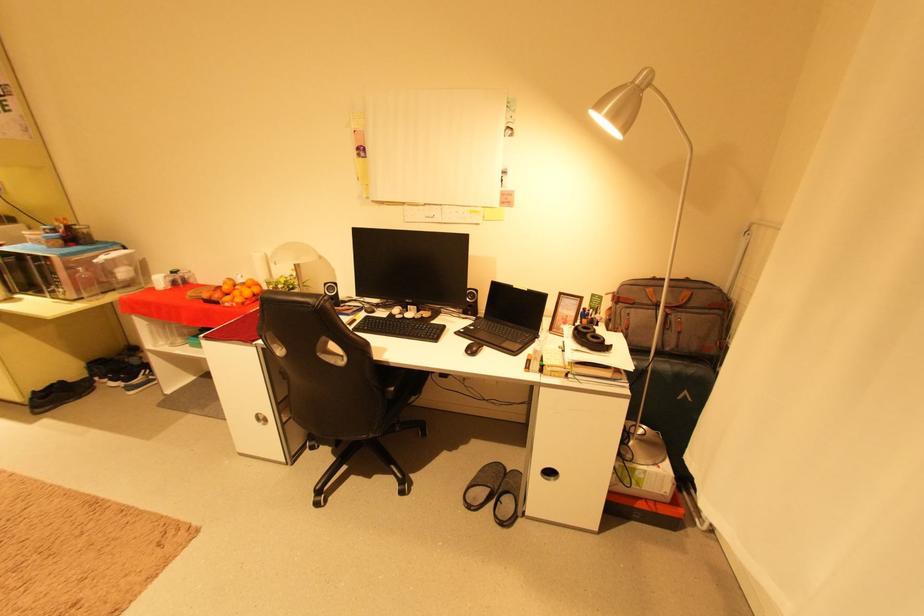
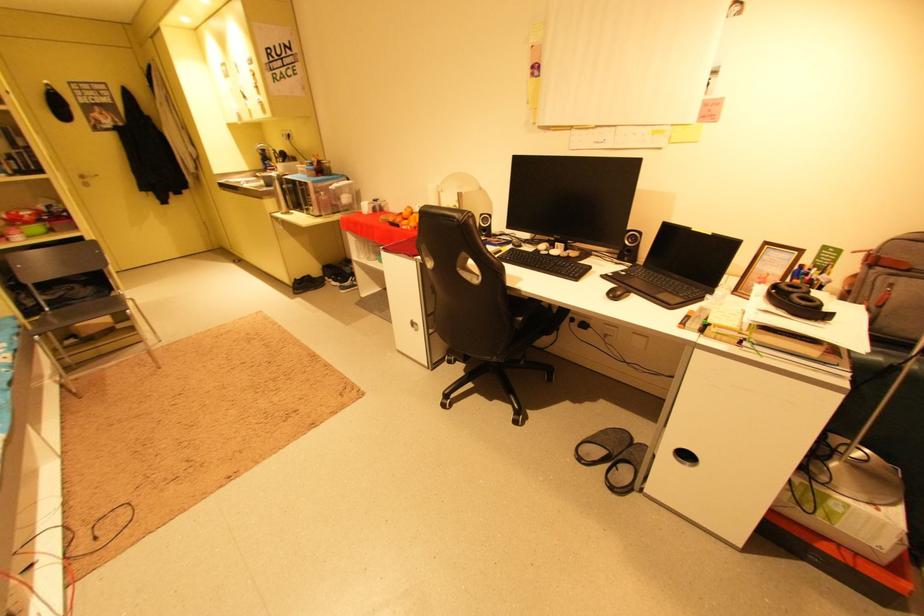
Find the pixel in the second image that matches (399,390) in the first image.

(529, 320)